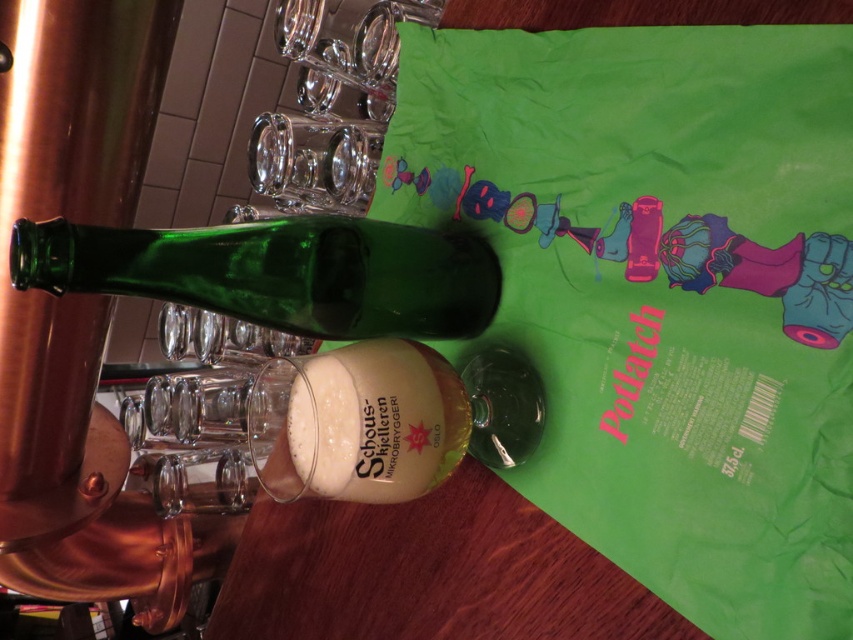
Which of these two, translucent glass mug at center or transparent glass at upper center, stands shorter?

translucent glass mug at center

Is translucent glass mug at center thinner than transparent glass at upper center?

Correct, translucent glass mug at center's width is less than transparent glass at upper center's.

I want to click on translucent glass mug at center, so click(357, 422).

Does green glass bottle at center have a greater width compared to transparent glass at upper center?

Correct, the width of green glass bottle at center exceeds that of transparent glass at upper center.

Which is more to the right, green glass bottle at center or transparent glass at upper center?

green glass bottle at center

Between point (28, 268) and point (315, 116), which one is positioned in front?

Point (28, 268)

The width and height of the screenshot is (853, 640). In order to click on green glass bottle at center in this screenshot , I will do `click(280, 273)`.

Is point (393, 240) closer to viewer compared to point (312, 358)?

No, (393, 240) is behind (312, 358).

Measure the distance between point (219, 253) and camera.

A distance of 39.23 centimeters exists between point (219, 253) and camera.

This screenshot has width=853, height=640. Identify the location of green glass bottle at center. (280, 273).

The height and width of the screenshot is (640, 853). What are the coordinates of `green glass bottle at center` in the screenshot? It's located at (280, 273).